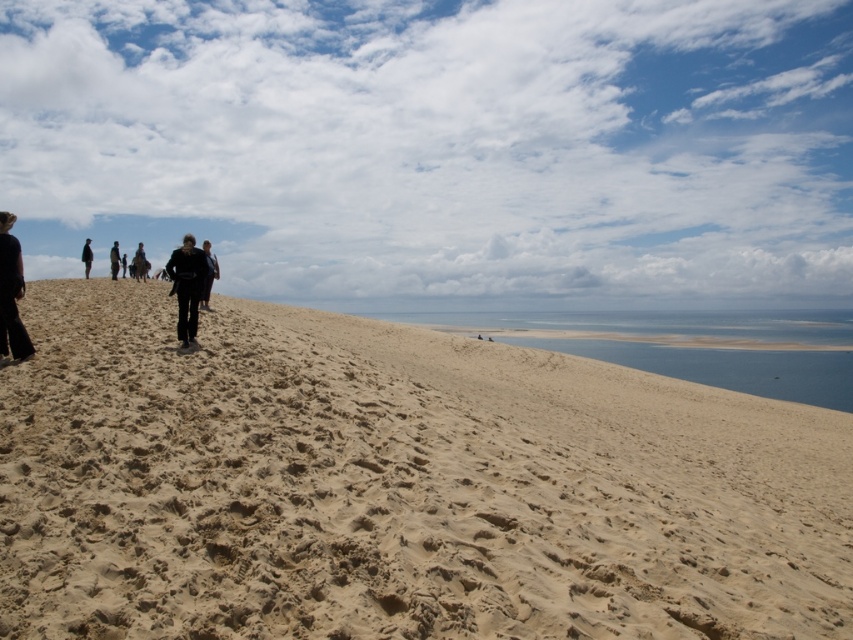
Which is above, light beige sand at upper center or black fabric person at upper center?

black fabric person at upper center is higher up.

Is point (111, 419) positioned before point (119, 260)?

Yes, it is in front of point (119, 260).

The image size is (853, 640). What do you see at coordinates (396, 484) in the screenshot?
I see `light beige sand at upper center` at bounding box center [396, 484].

In order to click on light beige sand at upper center in this screenshot , I will do `click(396, 484)`.

Is black fabric person at upper center shorter than black matte jacket at upper left?

In fact, black fabric person at upper center may be taller than black matte jacket at upper left.

Consider the image. Can you confirm if black fabric person at upper center is thinner than black matte jacket at upper left?

Incorrect, black fabric person at upper center's width is not less than black matte jacket at upper left's.

Who is more distant from viewer, [115,276] or [84,259]?

Positioned behind is point [84,259].

You are a GUI agent. You are given a task and a screenshot of the screen. Output one action in this format:
    pyautogui.click(x=<x>, y=<y>)
    Task: Click on the black fabric person at upper center
    
    Given the screenshot: What is the action you would take?
    pyautogui.click(x=114, y=259)

Is black matte pants at center positioned behind black leather jacket at upper center?

No, black matte pants at center is closer to the viewer.

Is black matte pants at center bigger than black leather jacket at upper center?

Incorrect, black matte pants at center is not larger than black leather jacket at upper center.

Describe the element at coordinates (187, 285) in the screenshot. The image size is (853, 640). I see `black matte pants at center` at that location.

At what (x,y) coordinates should I click in order to perform the action: click on black matte pants at center. Please return your answer as a coordinate pair (x, y). Image resolution: width=853 pixels, height=640 pixels. Looking at the image, I should click on (187, 285).